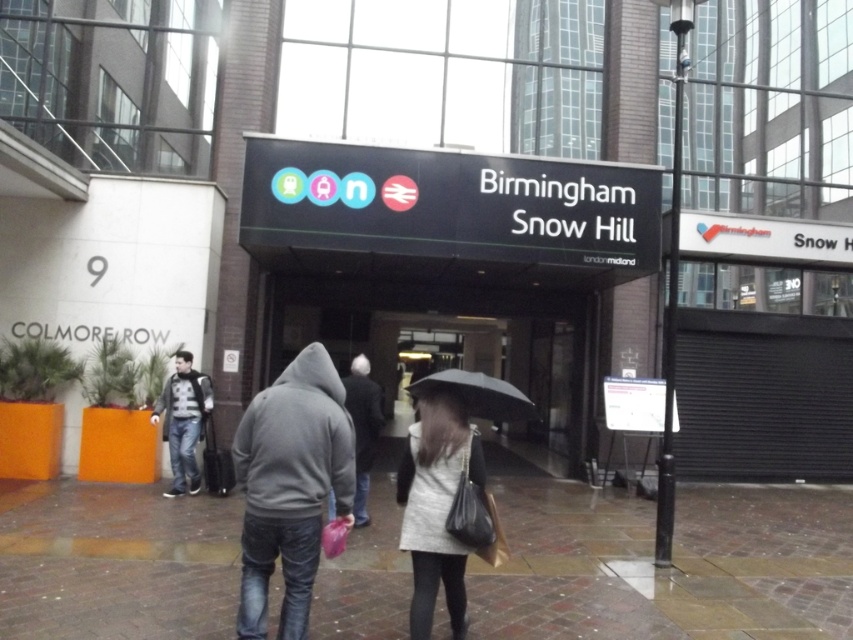
Question: Which is farther from the gray hoodie at center?

Choices:
 (A) brick pavement at lower center
 (B) denim jacket at center
 (C) dark gray hoodie at center
 (D) black matte umbrella at center

Answer: (B)

Question: Can you confirm if gray wool coat at center is positioned to the left of dark gray hoodie at center?

Choices:
 (A) no
 (B) yes

Answer: (A)

Question: Which is farther from the brick pavement at lower center?

Choices:
 (A) dark gray hoodie at center
 (B) gray wool coat at center
 (C) denim jacket at center
 (D) gray hoodie at center

Answer: (D)

Question: Based on their relative distances, which object is farther from the black matte umbrella at center?

Choices:
 (A) dark gray hoodie at center
 (B) brick pavement at lower center

Answer: (A)

Question: Does denim jacket at center appear on the left side of dark gray hoodie at center?

Choices:
 (A) no
 (B) yes

Answer: (B)

Question: Is brick pavement at lower center wider than dark gray hoodie at center?

Choices:
 (A) yes
 (B) no

Answer: (A)